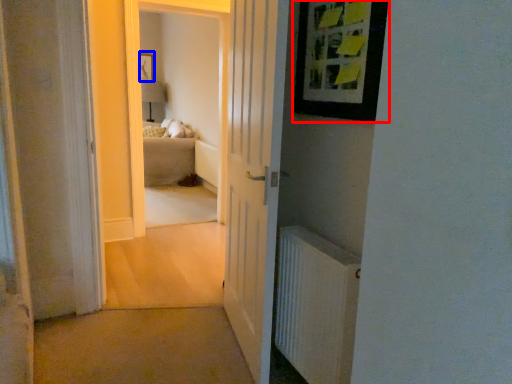
Question: Which of the following is the closest to the observer, picture frame (highlighted by a red box) or picture frame (highlighted by a blue box)?

Choices:
 (A) picture frame
 (B) picture frame

Answer: (A)